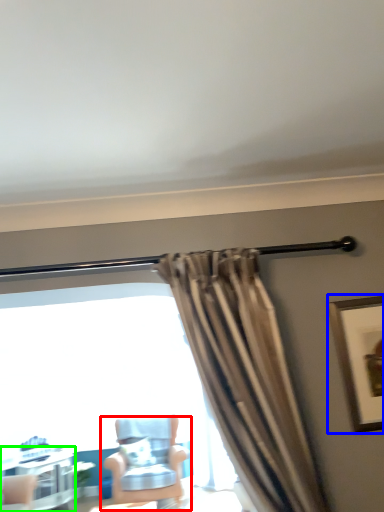
Question: Which object is the closest to the chair (highlighted by a red box)? Choose among these: picture frame (highlighted by a blue box) or table (highlighted by a green box).

Choices:
 (A) picture frame
 (B) table

Answer: (B)